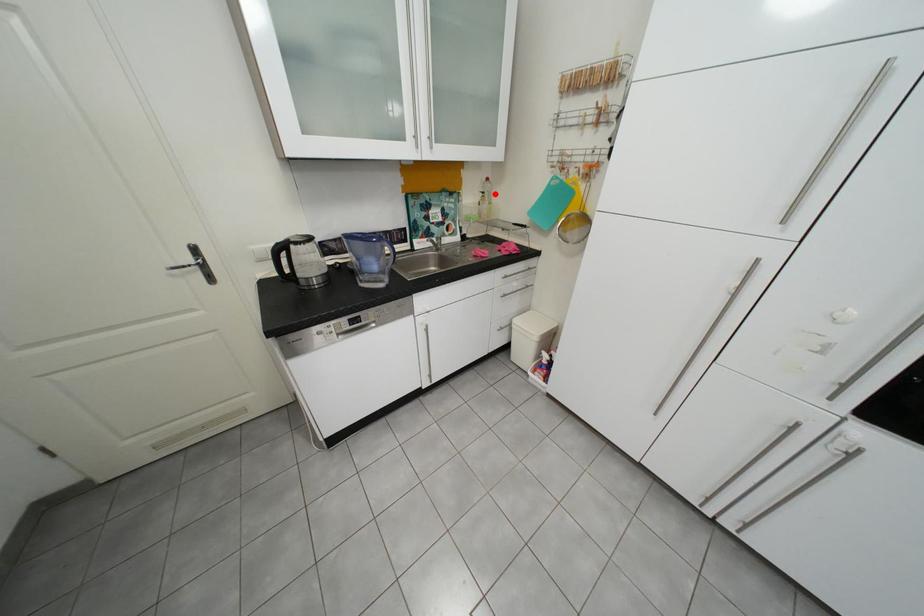
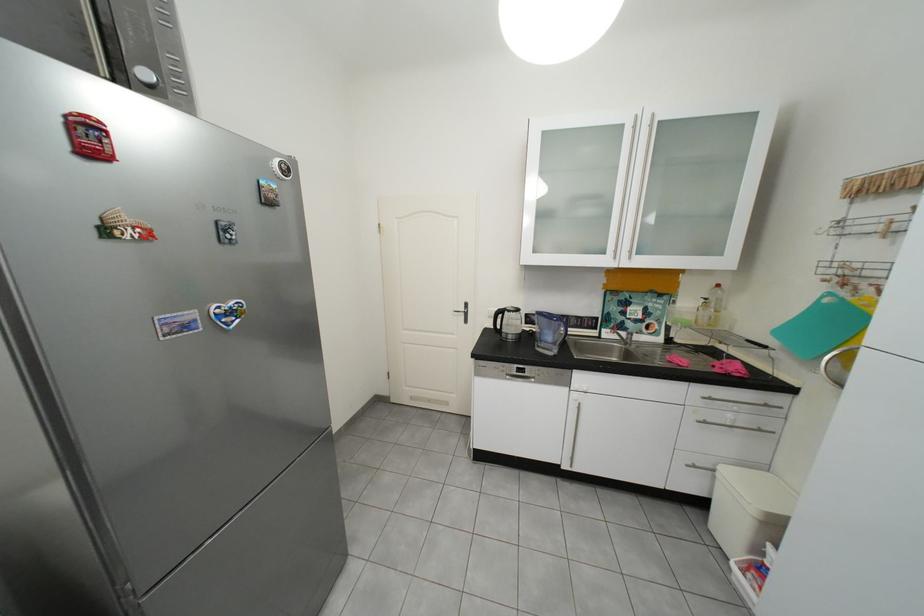
The point at the highlighted location is marked in the first image. Where is the corresponding point in the second image?

(718, 300)